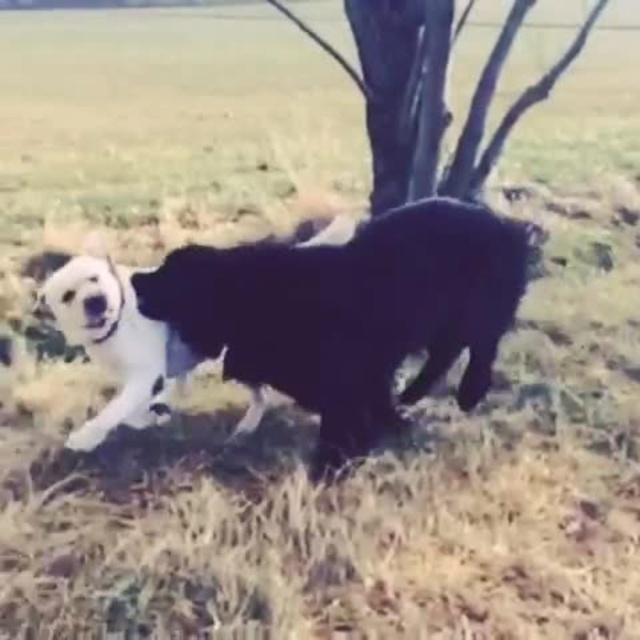
You are standing at the point marked by coordinates point (348, 314). Looking around, you see two dogs. Which dog is directly in front of you?

The black fluffy dog at center is directly in front of you at point (348, 314).

You are a photographer trying to capture a photo of the black fluffy dog at center and the black matte tree at upper center. You want both subjects to be in focus. The depth of field in your camera can cover 4 feet. Can you achieve this without adjusting your camera settings?

The black fluffy dog at center and the black matte tree at upper center are 4.10 feet apart from each other. Since the depth of field can only cover 4 feet, the distance between them exceeds the camera setting. Therefore, you cannot have both in focus without adjusting your camera settings.

You are standing in a field and see the black fluffy dog at center. If you want to throw a ball to reach it, and your throwing range is 2 meters, will you be able to reach the dog?

The black fluffy dog at center is 2.28 meters away from you. Since your throwing range is 2 meters, you cannot reach the dog with a single throw.